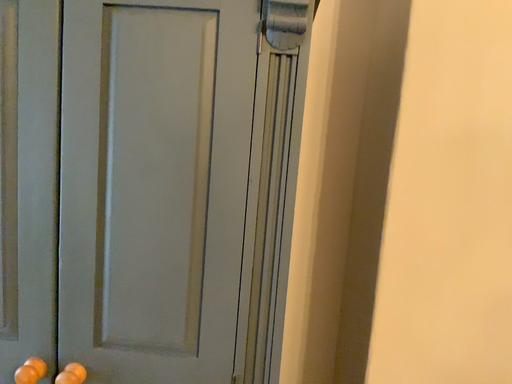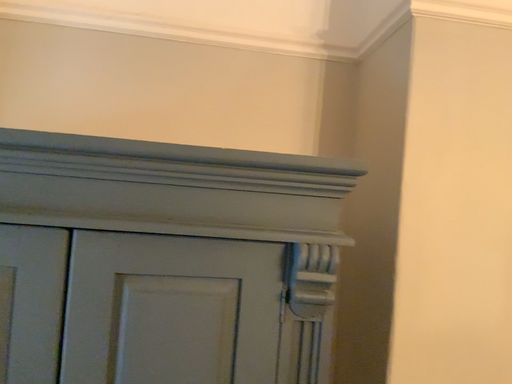
Question: Which way did the camera rotate in the video?

Choices:
 (A) rotated downward
 (B) rotated upward

Answer: (B)